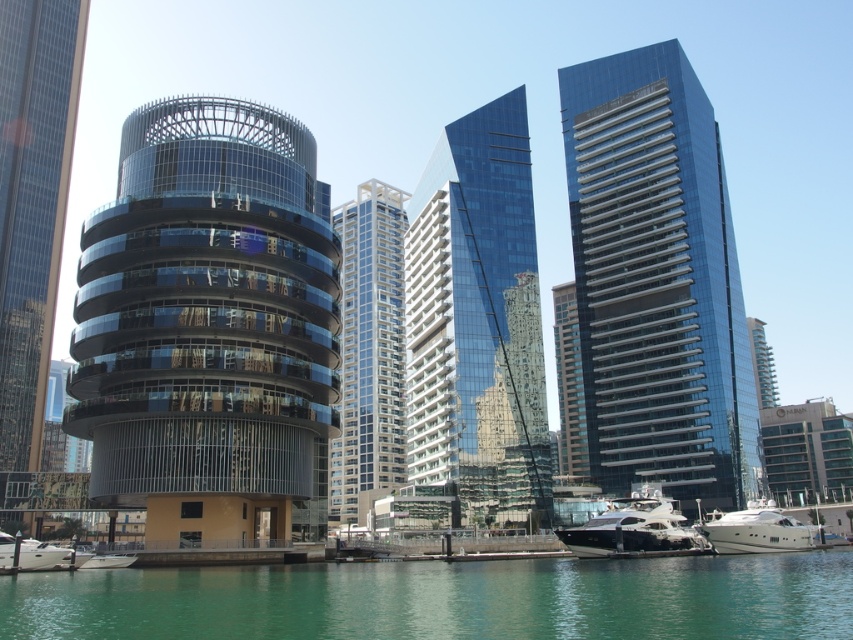
Question: Which object is closer to the camera taking this photo?

Choices:
 (A) glassy metallic tower at center
 (B) glassy blue skyscraper at right
 (C) transparent glass skyscraper at center
 (D) green water at lower center

Answer: (D)

Question: Which point is closer to the camera?

Choices:
 (A) (755, 516)
 (B) (6, 566)
 (C) (482, 273)
 (D) (379, 326)

Answer: (B)

Question: Which of the following is the closest to the observer?

Choices:
 (A) white glossy boat at lower left
 (B) glassy metallic tower at center
 (C) white glossy yacht at lower center
 (D) glassy modern building at left

Answer: (A)

Question: Can you confirm if glassy metallic tower at center is positioned to the left of white glossy yacht at lower center?

Choices:
 (A) no
 (B) yes

Answer: (B)

Question: Does glassy modern building at left have a larger size compared to clear glass building at center?

Choices:
 (A) yes
 (B) no

Answer: (B)

Question: Observing the image, what is the correct spatial positioning of shiny glass skyscraper at center in reference to white glossy yacht at lower right?

Choices:
 (A) left
 (B) right

Answer: (A)